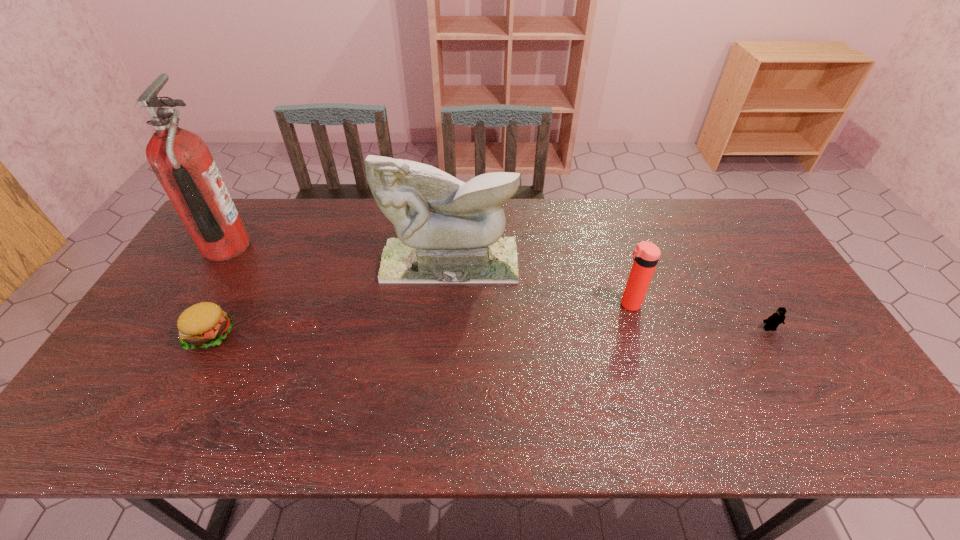
Where is `the tallest object`? Image resolution: width=960 pixels, height=540 pixels. the tallest object is located at coordinates (182, 162).

Locate an element on the screen. Image resolution: width=960 pixels, height=540 pixels. the third object from left to right is located at coordinates (449, 231).

Image resolution: width=960 pixels, height=540 pixels. I want to click on the fourth shortest object, so (x=449, y=231).

You are a GUI agent. You are given a task and a screenshot of the screen. Output one action in this format:
    pyautogui.click(x=<x>, y=<y>)
    Task: Click on the fourth object from left to right
    
    Given the screenshot: What is the action you would take?
    pyautogui.click(x=646, y=254)

Where is `the third tallest object`? This screenshot has height=540, width=960. the third tallest object is located at coordinates (646, 254).

Where is `hamburger`? The height and width of the screenshot is (540, 960). hamburger is located at coordinates (205, 324).

Find the location of a particular element. the rightmost object is located at coordinates (771, 323).

Where is `free space located on the front of the tallest object near the operation label`? This screenshot has width=960, height=540. free space located on the front of the tallest object near the operation label is located at coordinates (326, 247).

Identify the location of free space located on the base of the third object from left to right. (447, 298).

This screenshot has width=960, height=540. I want to click on vacant space located on the right of the second object from right to left, so click(x=732, y=304).